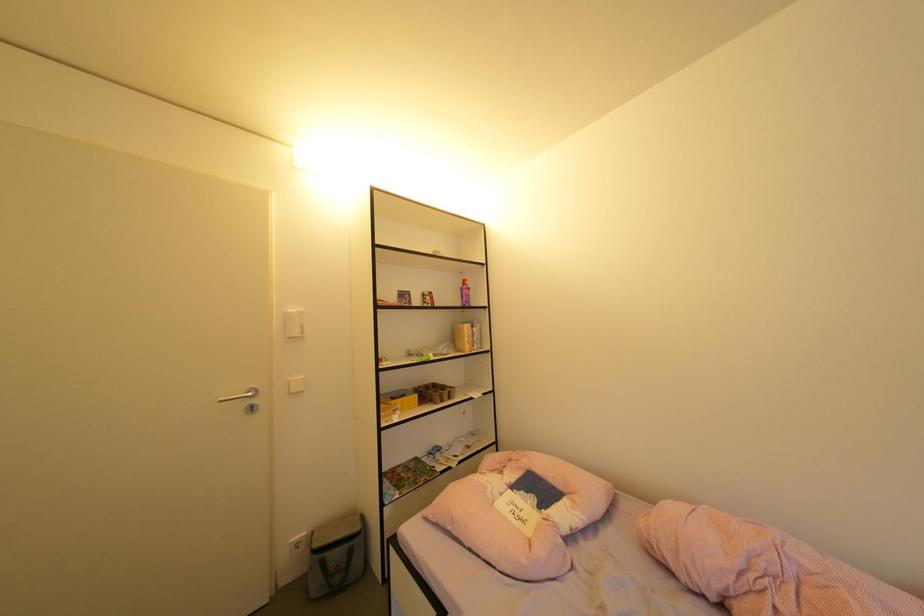
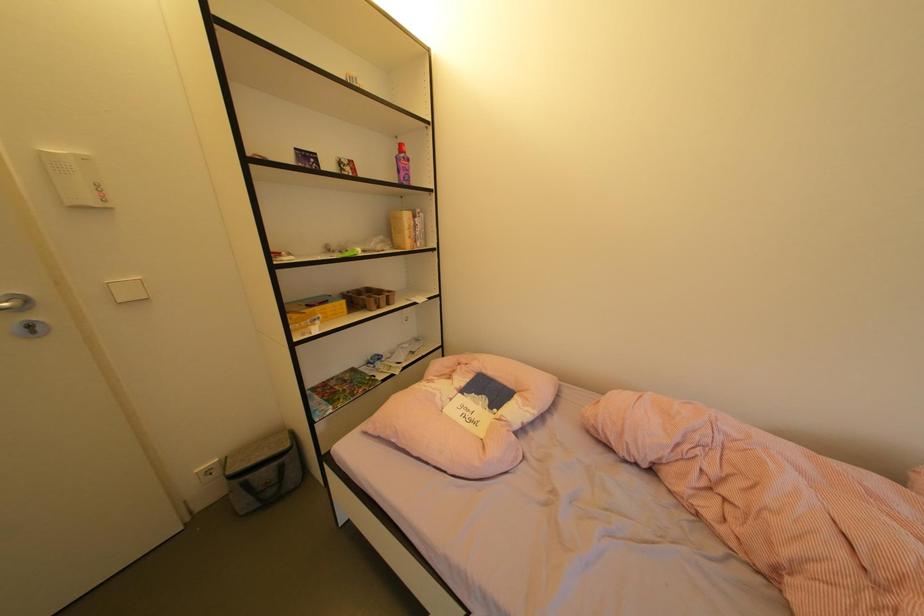
Question: The images are taken continuously from a first-person perspective. In which direction is your viewpoint rotating?

Choices:
 (A) Left
 (B) Right
 (C) Up
 (D) Down

Answer: (D)